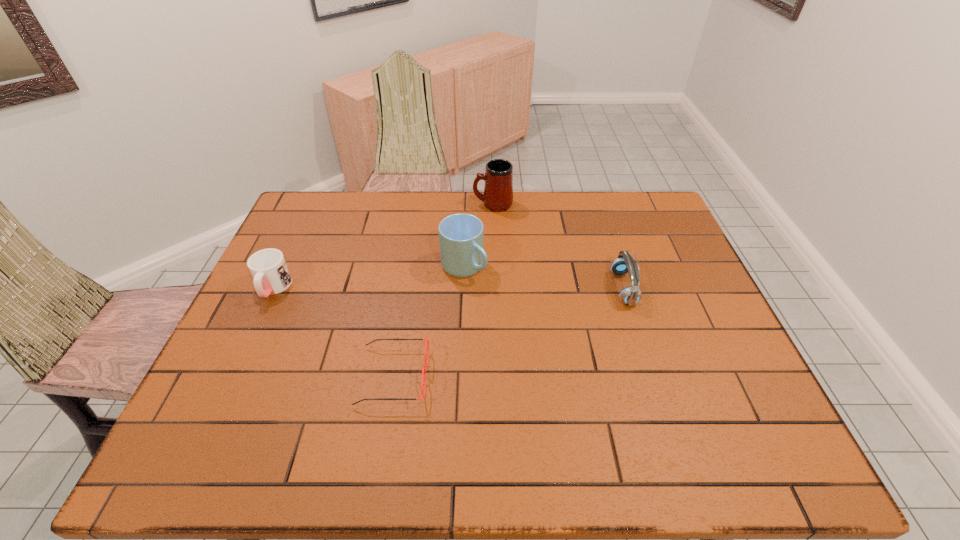
The image size is (960, 540). In order to click on vacant area situated on the ear cups of the third shortest object in this screenshot , I will do `click(529, 288)`.

The height and width of the screenshot is (540, 960). What are the coordinates of `vacant space located on the ear cups of the third shortest object` in the screenshot? It's located at (564, 288).

The image size is (960, 540). Identify the location of vacant space located on the ear cups of the third shortest object. (542, 288).

Locate an element on the screen. The width and height of the screenshot is (960, 540). free space located on the side of the leftmost mug with the handle is located at coordinates (206, 429).

Where is `blank space located on the front-facing side of the second object from left to right`? blank space located on the front-facing side of the second object from left to right is located at coordinates (508, 376).

In order to click on object that is at the far edge in this screenshot , I will do `click(498, 190)`.

Locate an element on the screen. object positioned at the left edge is located at coordinates (271, 275).

Identify the location of vacant space at the far edge of the desktop. The width and height of the screenshot is (960, 540). (420, 227).

Find the location of a particular element. This screenshot has height=540, width=960. vacant space at the near edge is located at coordinates (457, 432).

Where is `free space at the left edge`? This screenshot has width=960, height=540. free space at the left edge is located at coordinates (289, 319).